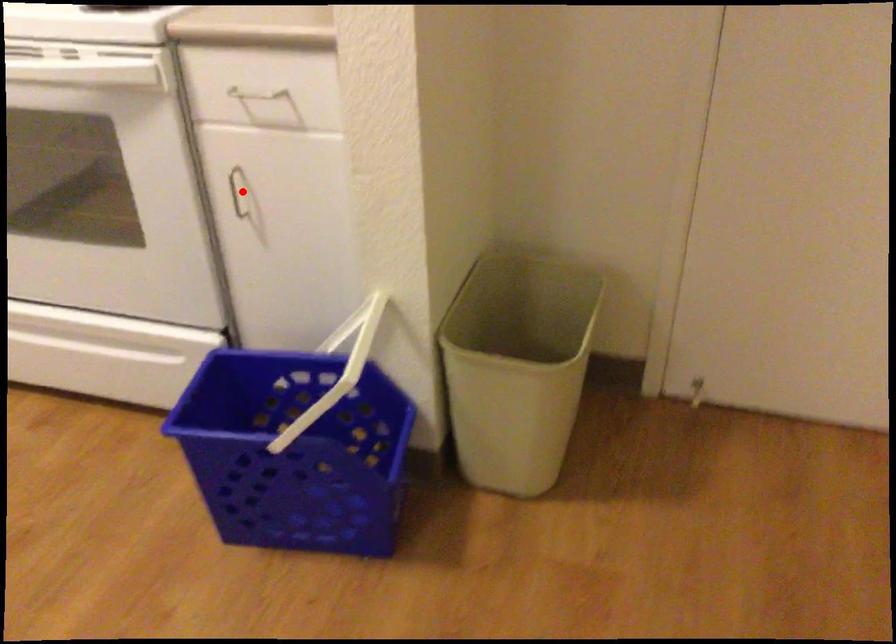
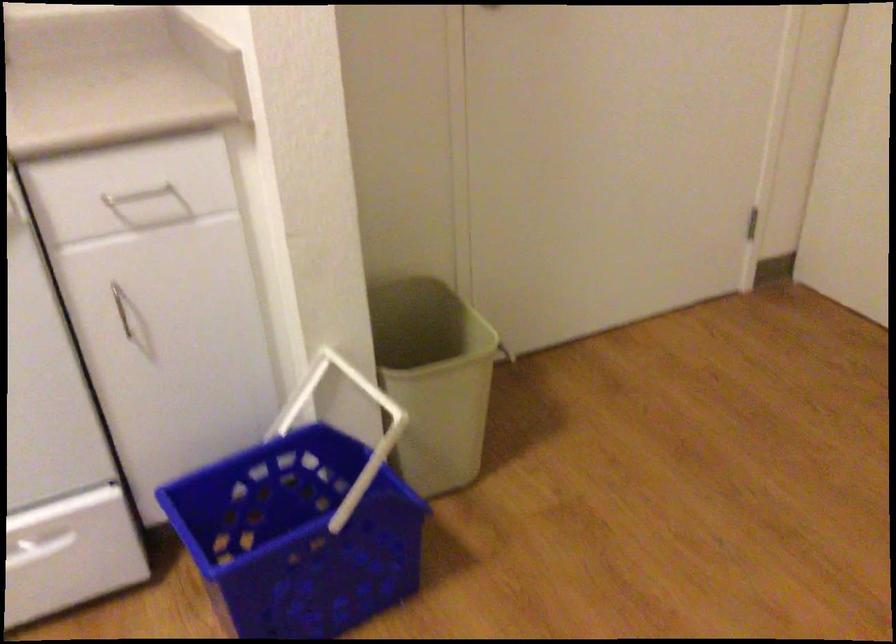
Question: I am providing you with two images of the same scene from different viewpoints. In image1, a red point is highlighted. Considering the same 3D point in image2, which of the following is correct?

Choices:
 (A) It is closer
 (B) It is farther

Answer: (A)